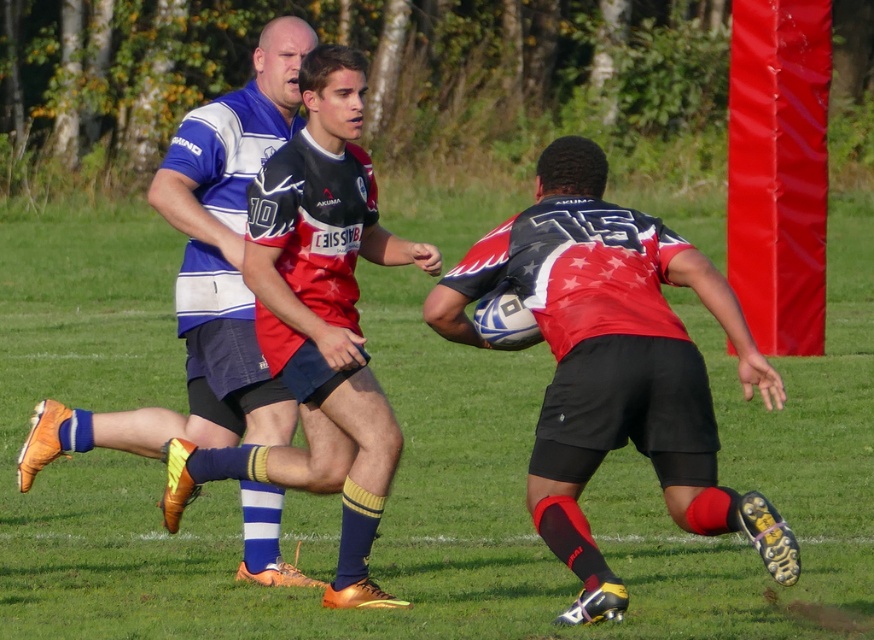
You are a spectator standing at the center of the field. You notice a point marked at coordinates point (497,620). If you want to throw a water bottle to that point, will it land within 8 meters from you?

The distance of point (497,620) from camera is 7.67 meters, so yes, the water bottle will land within 8 meters from you since the distance is less than 8 meters.

You are a referee standing on the green grass football field at center and you need to retrieve the matte red rugby ball at center. Can you reach it without moving more than 5 meters?

The distance between the green grass football field at center and the matte red rugby ball at center is 5.17 meters, which is slightly more than 5 meters. Therefore, you cannot reach the matte red rugby ball at center without moving more than 5 meters.